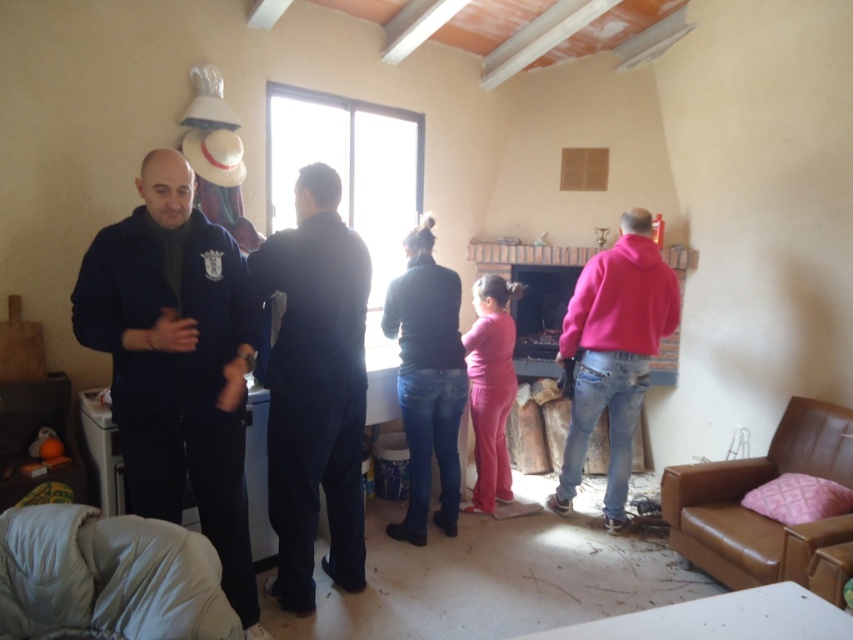
Please look at the scene and locate the point at coordinates (315, 388). What object or feature in the image corresponds to this coordinate?

The point at coordinates (315, 388) corresponds to the dark blue fabric at center.

You are organizing a closet and see two items, a dark blue fabric at center and a dark blue sweater at center. Which item is placed on top of the other?

The dark blue fabric at center is positioned over the dark blue sweater at center, so the dark blue fabric at center is on top.

You are organizing a photo shoot in this room and need to ensure that both the dark blue fabric at center and the dark blue sweater at center are visible in the frame. Which object should you position closer to the camera to achieve this?

To ensure both the dark blue fabric at center and the dark blue sweater at center are visible, position the dark blue fabric at center closer to the camera since it is already in front of the dark blue sweater at center.